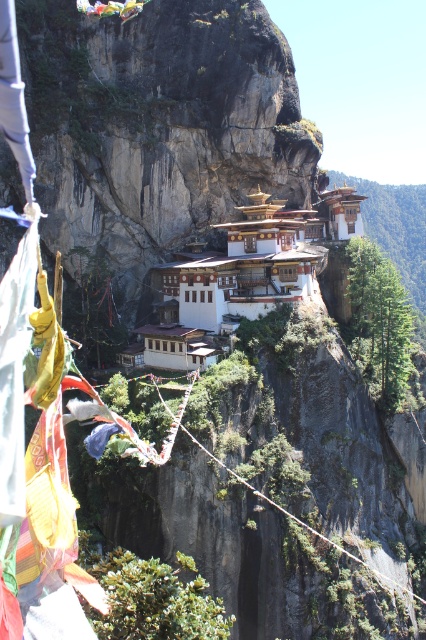
Looking at this image, measure the distance between white painted wood monastery at center and rope bridge at center.

The distance of white painted wood monastery at center from rope bridge at center is 26.14 meters.

Describe the element at coordinates (232, 282) in the screenshot. The width and height of the screenshot is (426, 640). I see `white painted wood monastery at center` at that location.

At what (x,y) coordinates should I click in order to perform the action: click on white painted wood monastery at center. Please return your answer as a coordinate pair (x, y). Looking at the image, I should click on (232, 282).